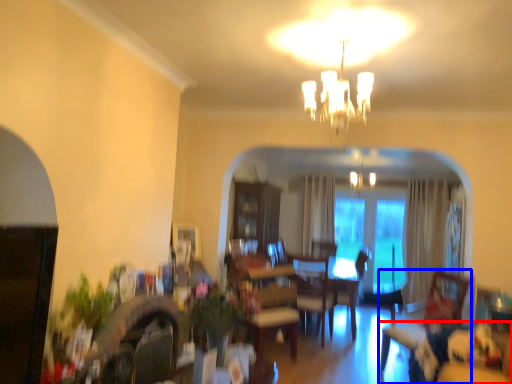
Question: Which of the following is the closest to the observer, couch (highlighted by a red box) or swivel chair (highlighted by a blue box)?

Choices:
 (A) couch
 (B) swivel chair

Answer: (A)